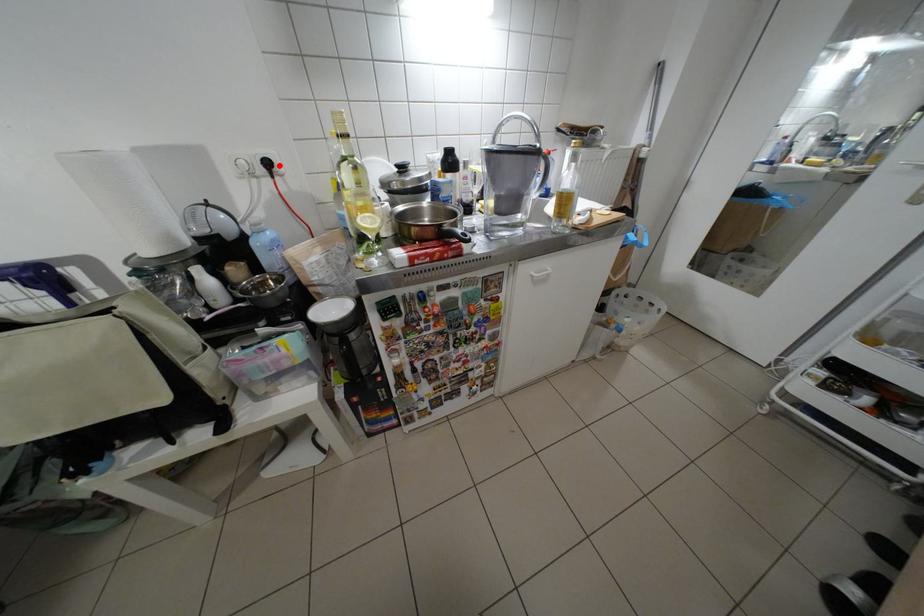
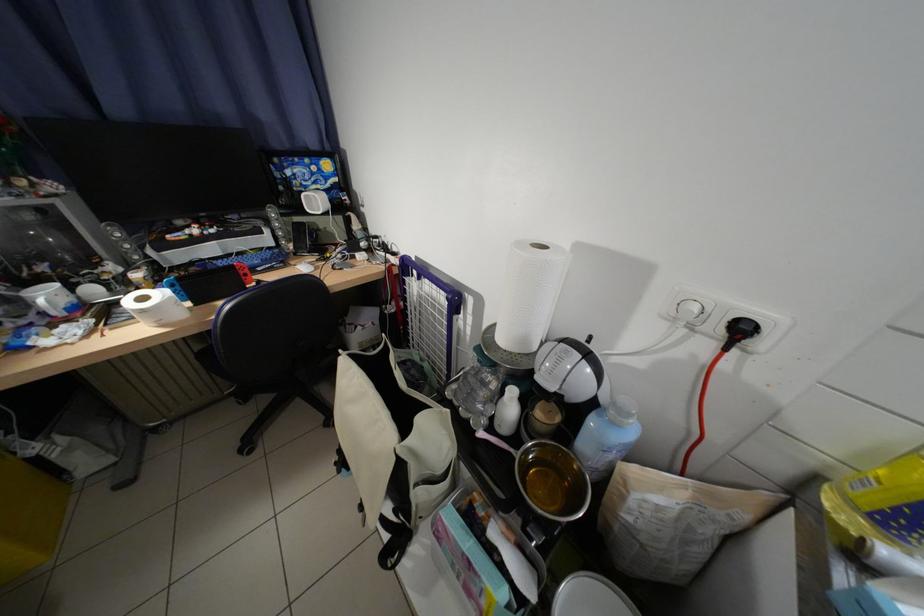
In the second image, find the point that corresponds to the highlighted location in the first image.

(754, 331)